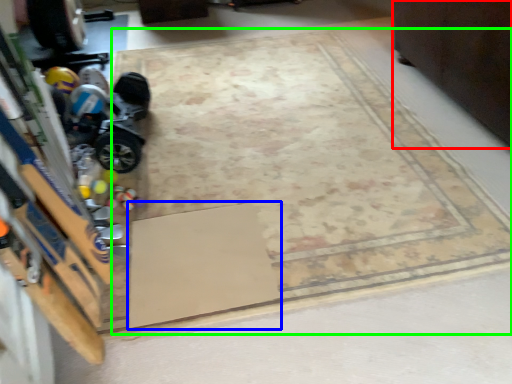
Question: Estimate the real-world distances between objects in this image. Which object is closer to furniture (highlighted by a red box), doormat (highlighted by a blue box) or mat (highlighted by a green box)?

Choices:
 (A) doormat
 (B) mat

Answer: (B)